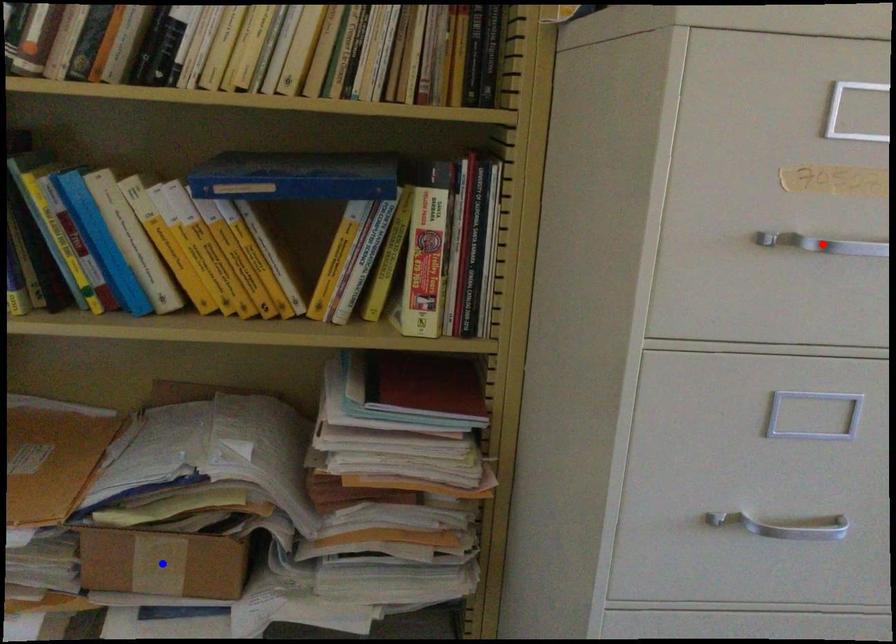
Question: Which of the two points in the image is closer to the camera?

Choices:
 (A) Blue point is closer.
 (B) Red point is closer.

Answer: (B)